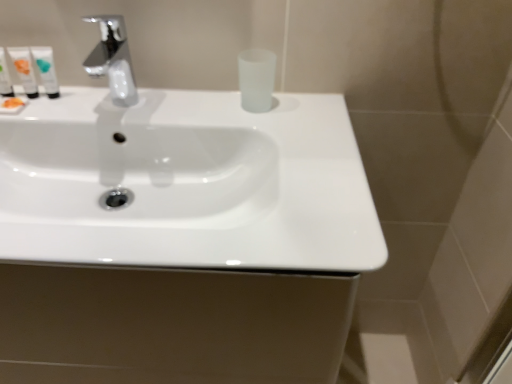
Question: Relative to white glossy tube at upper left, positioned as the third mouthwash in left-to-right order, is translucent plastic tube at left, marked as the fourth mouthwash in a right-to-left arrangement, in front or behind?

Choices:
 (A) behind
 (B) front

Answer: (B)

Question: Is translucent plastic tube at left, marked as the fourth mouthwash in a right-to-left arrangement, taller or shorter than white glossy tube at upper left, the 2th mouthwash positioned from the right?

Choices:
 (A) tall
 (B) short

Answer: (B)

Question: Which is nearer to the white glossy tube at upper left, marked as the 3th mouthwash in a right-to-left arrangement?

Choices:
 (A) translucent plastic tube at left, positioned as the first mouthwash in left-to-right order
 (B) white glossy tube at upper left, positioned as the third mouthwash in left-to-right order
 (C) white glossy sink at center
 (D) chrome metallic faucet at upper left
 (E) frosted glass cup at center, the fourth mouthwash viewed from the left

Answer: (B)

Question: Considering the real-world distances, which object is farthest from the translucent plastic tube at left, positioned as the first mouthwash in left-to-right order?

Choices:
 (A) white glossy tube at upper left, marked as the 3th mouthwash in a right-to-left arrangement
 (B) white glossy tube at upper left, positioned as the third mouthwash in left-to-right order
 (C) chrome metallic faucet at upper left
 (D) white glossy sink at center
 (E) frosted glass cup at center, marked as the first mouthwash in a right-to-left arrangement

Answer: (E)